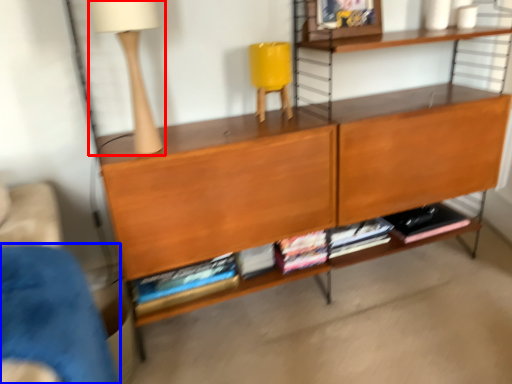
Question: Which object is closer to the camera taking this photo, table lamp (highlighted by a red box) or armchair (highlighted by a blue box)?

Choices:
 (A) table lamp
 (B) armchair

Answer: (B)